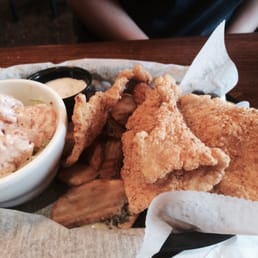
You are a GUI agent. You are given a task and a screenshot of the screen. Output one action in this format:
    pyautogui.click(x=<x>, y=<y>)
    Task: Click on the white napkin
    
    Given the screenshot: What is the action you would take?
    click(242, 243)